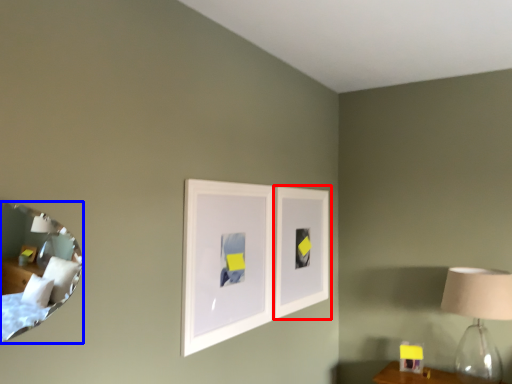
Question: Which point is closer to the camera, picture frame (highlighted by a red box) or mirror (highlighted by a blue box)?

Choices:
 (A) picture frame
 (B) mirror

Answer: (B)